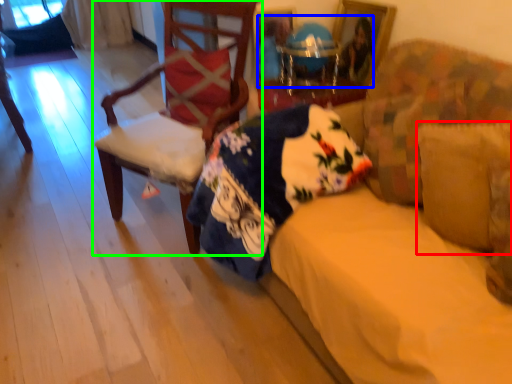
Question: Which object is the closest to the pillow (highlighted by a red box)? Choose among these: couple (highlighted by a blue box) or chair (highlighted by a green box).

Choices:
 (A) couple
 (B) chair

Answer: (A)